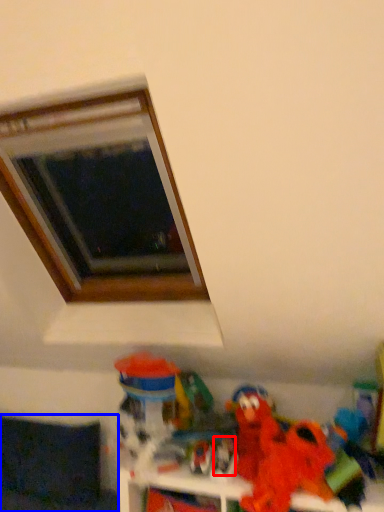
Question: Which object is further to the camera taking this photo, toy (highlighted by a red box) or couch (highlighted by a blue box)?

Choices:
 (A) toy
 (B) couch

Answer: (B)